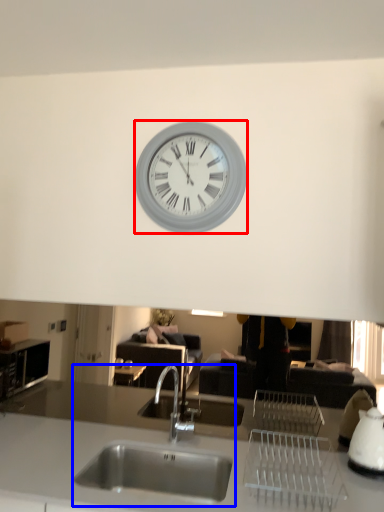
Question: Which point is closer to the camera, wall clock (highlighted by a red box) or sink (highlighted by a blue box)?

Choices:
 (A) wall clock
 (B) sink

Answer: (B)